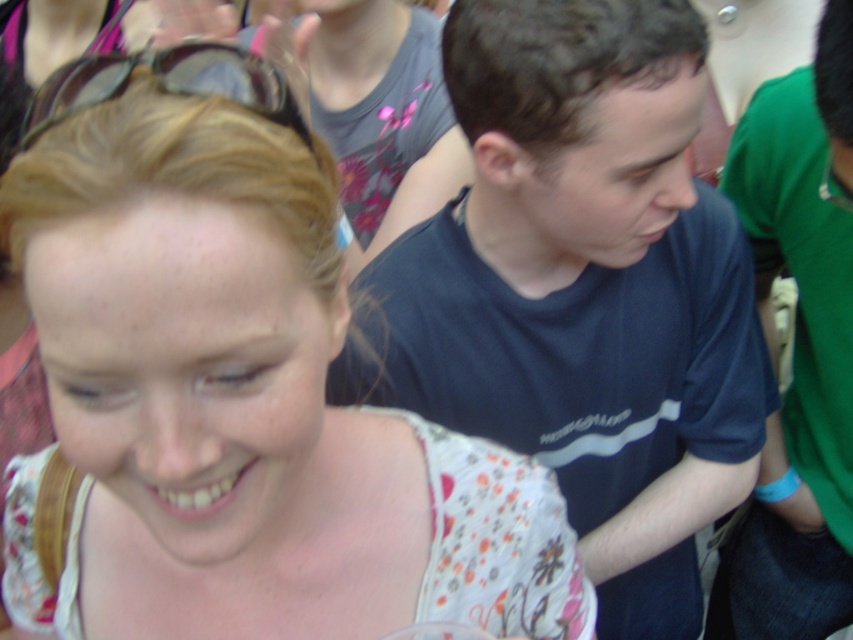
Between dark blue t-shirt at center and black plastic goggles at upper left, which one is positioned higher?

black plastic goggles at upper left

Is dark blue t-shirt at center in front of black plastic goggles at upper left?

That is False.

Does point (358, 362) lie in front of point (115, 76)?

No.

Find the location of `dark blue t-shirt at center`. dark blue t-shirt at center is located at coordinates (582, 291).

Who is positioned more to the left, matte gray shirt at upper center or black plastic goggles at upper left?

black plastic goggles at upper left is more to the left.

What are the coordinates of `matte gray shirt at upper center` in the screenshot? It's located at (381, 115).

Is floral fabric dress at center above matte gray shirt at upper center?

Incorrect, floral fabric dress at center is not positioned above matte gray shirt at upper center.

Which is more to the left, floral fabric dress at center or matte gray shirt at upper center?

floral fabric dress at center is more to the left.

Does point (247, 312) come farther from viewer compared to point (376, 188)?

No, it is not.

This screenshot has width=853, height=640. I want to click on floral fabric dress at center, so coord(234,394).